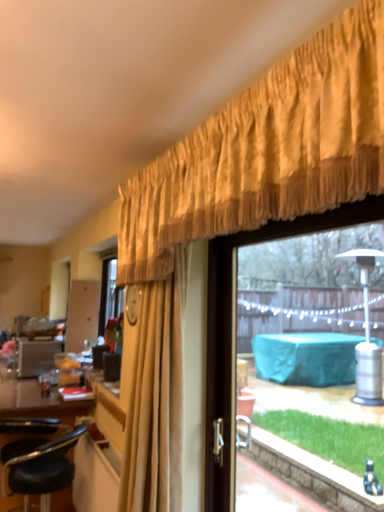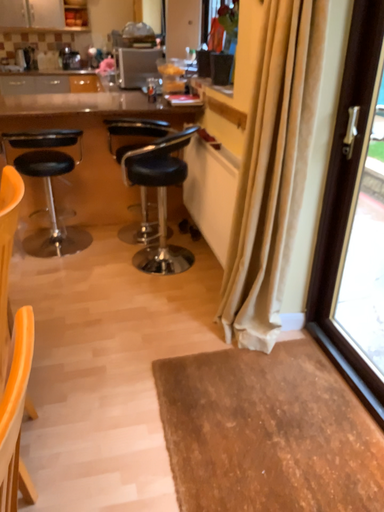
Question: Which way did the camera rotate in the video?

Choices:
 (A) rotated left
 (B) rotated right

Answer: (A)